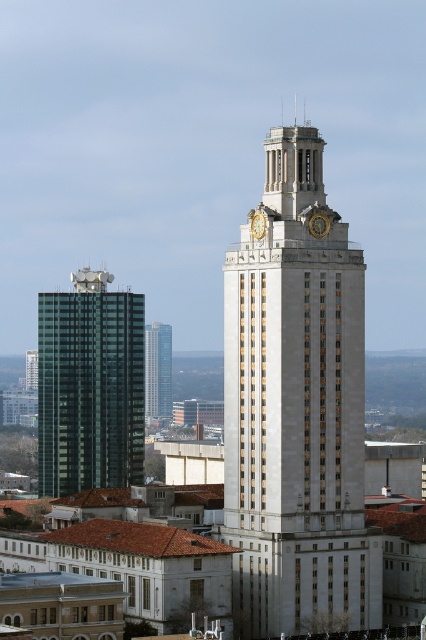
Which is more to the left, green glass building at left or white stone clock tower at upper center?

green glass building at left

Who is higher up, green glass building at left or white stone clock tower at upper center?

white stone clock tower at upper center

Who is more distant from viewer, [55,364] or [275,140]?

The point [55,364] is behind.

Where is `green glass building at left`? green glass building at left is located at coordinates (89, 387).

Can you confirm if green glass building at left is wider than gold metallic clock at center?

Indeed, green glass building at left has a greater width compared to gold metallic clock at center.

Which is in front, point (100, 339) or point (259, 220)?

Positioned in front is point (259, 220).

Where is `green glass building at left`? The height and width of the screenshot is (640, 426). green glass building at left is located at coordinates (89, 387).

Who is taller, green glass building at left or goldmaterial/textureclock at upper center?

green glass building at left is taller.

Image resolution: width=426 pixels, height=640 pixels. Identify the location of green glass building at left. (89, 387).

This screenshot has width=426, height=640. What are the coordinates of `green glass building at left` in the screenshot? It's located at (89, 387).